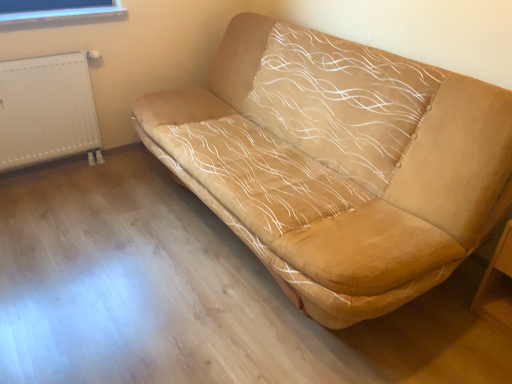
In order to face wooden table at lower right, should I rotate leftwards or rightwards?

You should look right and rotate roughly 32.914 degrees.

You are a GUI agent. You are given a task and a screenshot of the screen. Output one action in this format:
    pyautogui.click(x=<x>, y=<y>)
    Task: Click on the suede-like beige sofa at center
    
    Given the screenshot: What is the action you would take?
    pyautogui.click(x=338, y=163)

What do you see at coordinates (47, 110) in the screenshot? The image size is (512, 384). I see `white plastic radiator at left` at bounding box center [47, 110].

In order to click on white plastic radiator at left in this screenshot , I will do `click(47, 110)`.

Locate an element on the screen. Image resolution: width=512 pixels, height=384 pixels. wooden table at lower right is located at coordinates (497, 285).

Where is `radiator directly beneath the suede-like beige sofa at center (from a real-world perspective)`? radiator directly beneath the suede-like beige sofa at center (from a real-world perspective) is located at coordinates (47, 110).

Considering the relative positions of white plastic radiator at left and suede-like beige sofa at center in the image provided, is white plastic radiator at left in front of suede-like beige sofa at center?

No, white plastic radiator at left is behind suede-like beige sofa at center.

From the picture: Looking at the image, does white plastic radiator at left seem bigger or smaller compared to suede-like beige sofa at center?

white plastic radiator at left is smaller than suede-like beige sofa at center.

Considering the positions of objects white plastic radiator at left and wooden table at lower right in the image provided, who is more to the left, white plastic radiator at left or wooden table at lower right?

white plastic radiator at left.

Is white plastic radiator at left directly adjacent to wooden table at lower right?

No, white plastic radiator at left is not next to wooden table at lower right.

In terms of size, does white plastic radiator at left appear bigger or smaller than wooden table at lower right?

white plastic radiator at left is bigger than wooden table at lower right.

What's the angular difference between white plastic radiator at left and wooden table at lower right's facing directions?

The angular difference between white plastic radiator at left and wooden table at lower right is 89.9 degrees.

Is wooden table at lower right inside or outside of white plastic radiator at left?

wooden table at lower right is spatially situated outside white plastic radiator at left.

From the image's perspective, does wooden table at lower right appear lower than white plastic radiator at left?

Correct, wooden table at lower right appears lower than white plastic radiator at left in the image.

Is wooden table at lower right positioned in front of white plastic radiator at left?

Yes, it is.

Considering the sizes of objects wooden table at lower right and white plastic radiator at left in the image provided, who is wider, wooden table at lower right or white plastic radiator at left?

With larger width is wooden table at lower right.

From the image's perspective, which one is positioned lower, suede-like beige sofa at center or wooden table at lower right?

wooden table at lower right appears lower in the image.

How much distance is there between suede-like beige sofa at center and wooden table at lower right?

suede-like beige sofa at center and wooden table at lower right are 34.06 inches apart from each other.

Considering the relative sizes of suede-like beige sofa at center and wooden table at lower right in the image provided, is suede-like beige sofa at center thinner than wooden table at lower right?

Incorrect, the width of suede-like beige sofa at center is not less than that of wooden table at lower right.

Is point (196, 121) closer to camera compared to point (95, 116)?

Yes, point (196, 121) is closer to viewer.

From the image's perspective, is suede-like beige sofa at center above or below white plastic radiator at left?

Clearly, from the image's perspective, suede-like beige sofa at center is below white plastic radiator at left.

Between suede-like beige sofa at center and white plastic radiator at left, which one has smaller size?

white plastic radiator at left is smaller.

Locate an element on the screen. Image resolution: width=512 pixels, height=384 pixels. studio couch in front of the white plastic radiator at left is located at coordinates (338, 163).

Could you tell me if wooden table at lower right is facing suede-like beige sofa at center?

A: No, wooden table at lower right is not aimed at suede-like beige sofa at center.

Does point (497, 287) appear closer or farther from the camera than point (460, 261)?

Clearly, point (497, 287) is more distant from the camera than point (460, 261).

Can you tell me how much wooden table at lower right and suede-like beige sofa at center differ in facing direction?

The angular difference between wooden table at lower right and suede-like beige sofa at center is 0.74 degrees.

Does wooden table at lower right have a lesser height compared to suede-like beige sofa at center?

Indeed, wooden table at lower right has a lesser height compared to suede-like beige sofa at center.

Where is `radiator that appears above the suede-like beige sofa at center (from the image's perspective)`? radiator that appears above the suede-like beige sofa at center (from the image's perspective) is located at coordinates (47, 110).

This screenshot has width=512, height=384. Find the location of `radiator behind the wooden table at lower right`. radiator behind the wooden table at lower right is located at coordinates (47, 110).

Which object lies further to the anchor point suede-like beige sofa at center, white plastic radiator at left or wooden table at lower right?

Based on the image, white plastic radiator at left appears to be further to suede-like beige sofa at center.

Considering their positions, is suede-like beige sofa at center positioned further to wooden table at lower right than white plastic radiator at left?

Among the two, white plastic radiator at left is located further to wooden table at lower right.

Looking at the image, which one is located further to suede-like beige sofa at center, wooden table at lower right or white plastic radiator at left?

white plastic radiator at left lies further to suede-like beige sofa at center than the other object.

From the image, which object appears to be farther from wooden table at lower right, white plastic radiator at left or suede-like beige sofa at center?

Among the two, white plastic radiator at left is located further to wooden table at lower right.

Considering their positions, is wooden table at lower right positioned further to white plastic radiator at left than suede-like beige sofa at center?

wooden table at lower right lies further to white plastic radiator at left than the other object.

Consider the image. From the image, which object appears to be nearer to white plastic radiator at left, suede-like beige sofa at center or wooden table at lower right?

suede-like beige sofa at center is positioned closer to the anchor white plastic radiator at left.

You are a GUI agent. You are given a task and a screenshot of the screen. Output one action in this format:
    pyautogui.click(x=<x>, y=<y>)
    Task: Click on the studio couch located between white plastic radiator at left and wooden table at lower right in the left-right direction
    This screenshot has width=512, height=384.
    Given the screenshot: What is the action you would take?
    pyautogui.click(x=338, y=163)